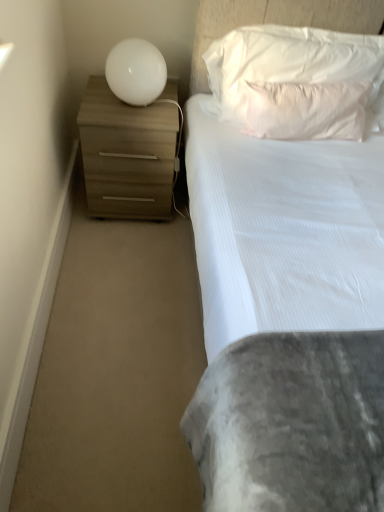
The image size is (384, 512). Find the location of `free space above matte wood chest of drawers at left (from a real-world perspective)`. free space above matte wood chest of drawers at left (from a real-world perspective) is located at coordinates (125, 106).